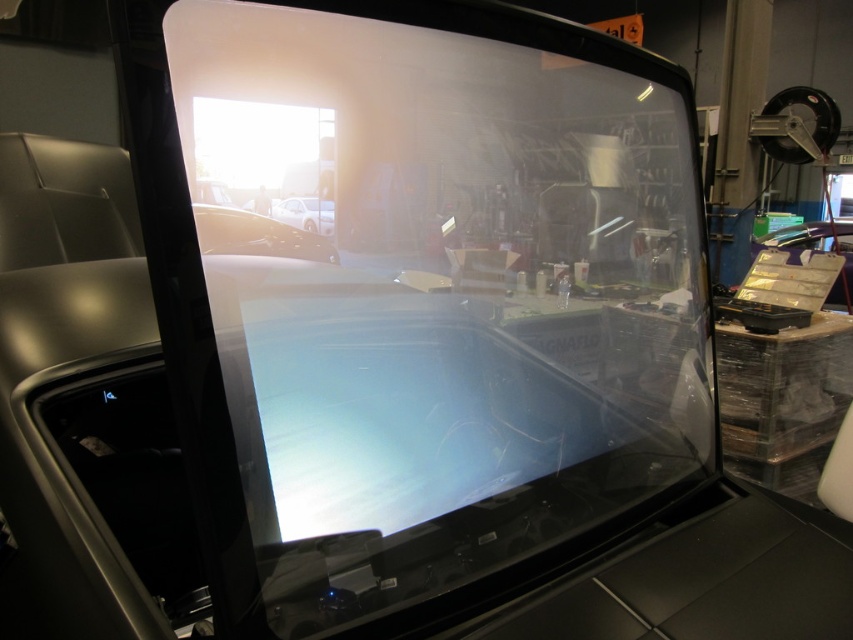
Question: Does glossy white car at center have a smaller size compared to matte black car at right?

Choices:
 (A) yes
 (B) no

Answer: (A)

Question: Among these points, which one is farthest from the camera?

Choices:
 (A) (285, 205)
 (B) (281, 243)

Answer: (B)

Question: Which point appears closest to the camera in this image?

Choices:
 (A) (294, 196)
 (B) (209, 227)
 (C) (779, 237)

Answer: (B)

Question: Which object is closer to the camera taking this photo?

Choices:
 (A) matte black car at right
 (B) glossy white car at center
 (C) white glossy car at center

Answer: (B)

Question: Can you confirm if glossy white car at center is positioned to the left of white glossy car at center?

Choices:
 (A) yes
 (B) no

Answer: (A)

Question: Is glossy white car at center below white glossy car at center?

Choices:
 (A) no
 (B) yes

Answer: (B)